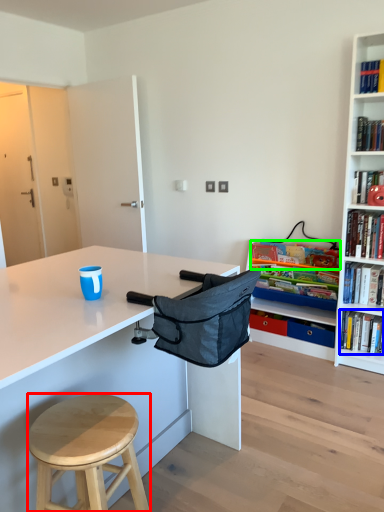
Question: Estimate the real-world distances between objects in this image. Which object is closer to stool (highlighted by a red box), book (highlighted by a blue box) or book (highlighted by a green box)?

Choices:
 (A) book
 (B) book

Answer: (A)